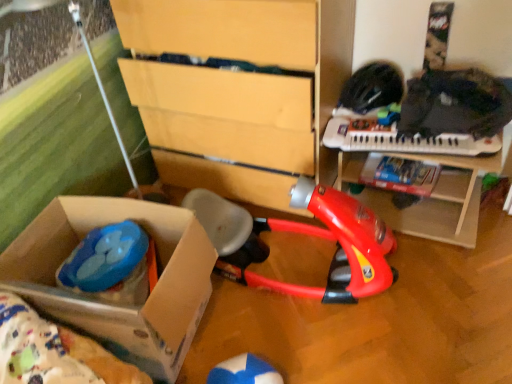
Question: From a real-world perspective, is wooden toy table at center on top of red plastic vacuum cleaner at center, placed as the second toy when sorted from left to right?

Choices:
 (A) no
 (B) yes

Answer: (A)

Question: From a real-world perspective, is wooden toy table at center below red plastic vacuum cleaner at center, placed as the second toy when sorted from left to right?

Choices:
 (A) yes
 (B) no

Answer: (A)

Question: Does wooden toy table at center contain red plastic vacuum cleaner at center, the 1th toy positioned from the right?

Choices:
 (A) no
 (B) yes

Answer: (A)

Question: From the image's perspective, is wooden toy table at center below red plastic vacuum cleaner at center, placed as the second toy when sorted from left to right?

Choices:
 (A) yes
 (B) no

Answer: (B)

Question: Is wooden toy table at center placed right next to red plastic vacuum cleaner at center, the 1th toy positioned from the right?

Choices:
 (A) yes
 (B) no

Answer: (B)

Question: Would you say wooden toy table at center is outside red plastic vacuum cleaner at center, placed as the second toy when sorted from left to right?

Choices:
 (A) no
 (B) yes

Answer: (B)

Question: Is white plastic keyboard at upper right to the right of cardboard box at lower left from the viewer's perspective?

Choices:
 (A) yes
 (B) no

Answer: (A)

Question: From the image's perspective, would you say white plastic keyboard at upper right is shown under cardboard box at lower left?

Choices:
 (A) no
 (B) yes

Answer: (A)

Question: Is white plastic keyboard at upper right thinner than cardboard box at lower left?

Choices:
 (A) no
 (B) yes

Answer: (B)

Question: Is white plastic keyboard at upper right closer to the viewer compared to cardboard box at lower left?

Choices:
 (A) yes
 (B) no

Answer: (B)

Question: Could you tell me if white plastic keyboard at upper right is turned towards cardboard box at lower left?

Choices:
 (A) yes
 (B) no

Answer: (B)

Question: Can you confirm if white plastic keyboard at upper right is positioned to the left of cardboard box at lower left?

Choices:
 (A) no
 (B) yes

Answer: (A)

Question: Does wooden toy table at center have a greater width compared to cardboard box at lower left?

Choices:
 (A) yes
 (B) no

Answer: (B)